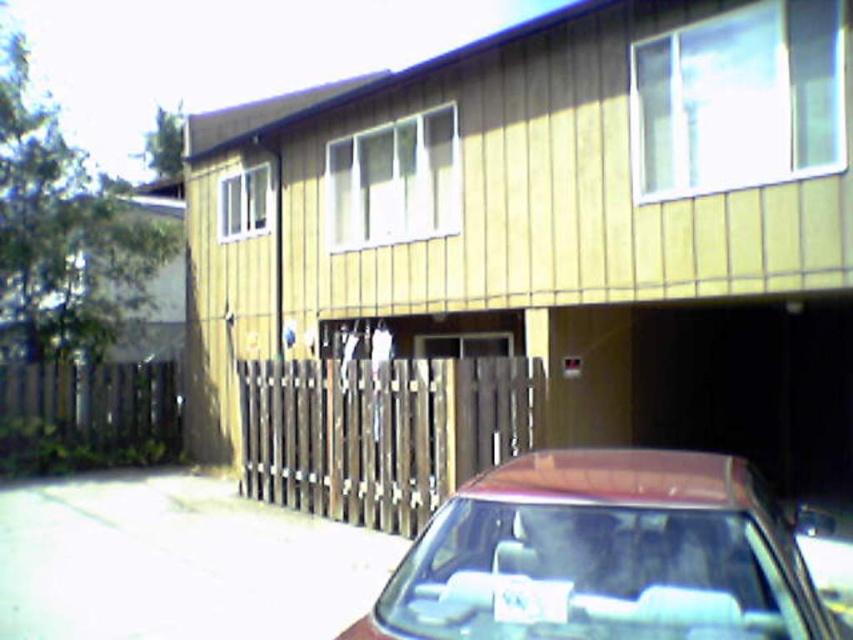
You are standing in front of the residential building and want to take a photo. You notice two points marked in the scene. Which point is closer to your camera, point (196,492) or point (512,621)?

Point (196,492) is closer to the camera than point (512,621).

You are a delivery person trying to park your van next to the shiny maroon sedan at lower center and the white concrete driveway at lower left. Since your van is 2.2 meters tall, can you safely drive under the air conditioning units on the building without hitting them?

The shiny maroon sedan at lower center is taller than the white concrete driveway at lower left. However, the question is about the height of the air conditioning units on the building. The provided information does not specify the height of the air conditioning units, so it is impossible to determine if the van can safely pass under them based on the given details.